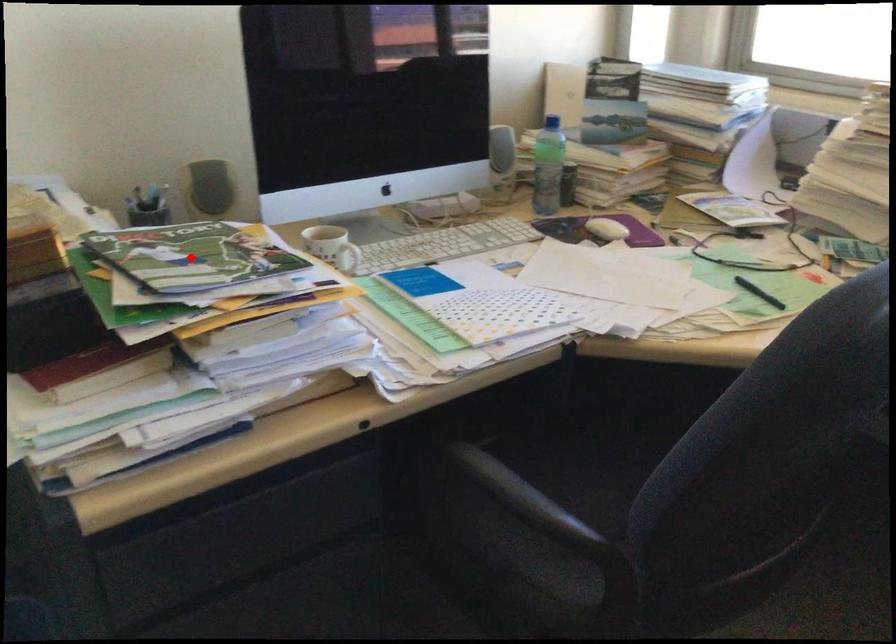
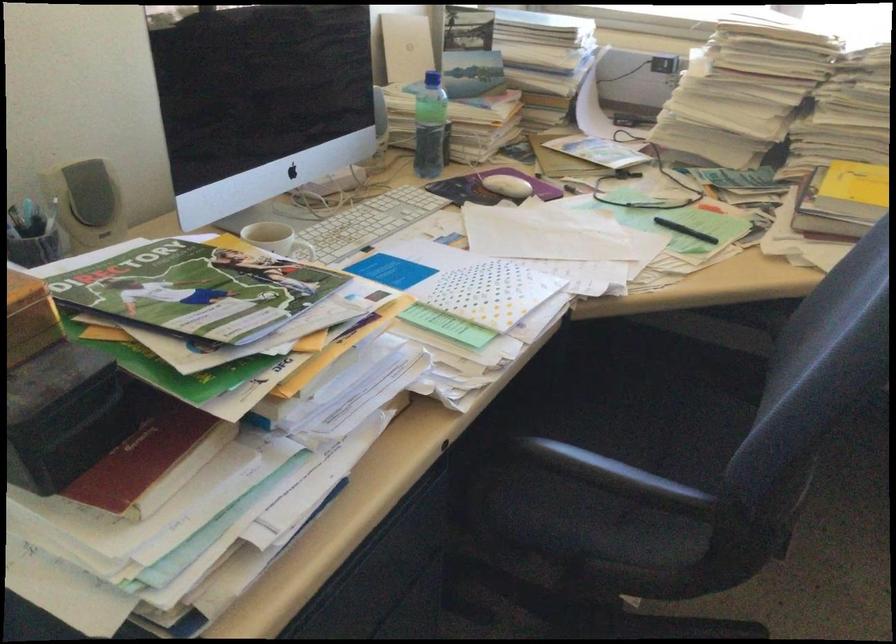
Question: I am providing you with two images of the same scene from different viewpoints. Image1 has a red point marked. In image2, the corresponding 3D location appears at what relative position? Reply with the corresponding letter.

Choices:
 (A) Closer
 (B) Farther

Answer: (A)